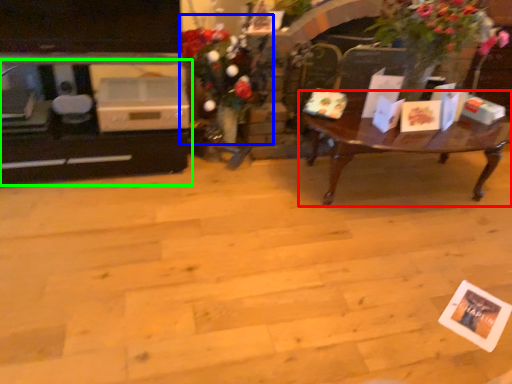
Question: Which object is positioned farthest from coffee table (highlighted by a red box)? Select from floral arrangement (highlighted by a blue box) and entertainment center (highlighted by a green box).

Choices:
 (A) floral arrangement
 (B) entertainment center

Answer: (B)